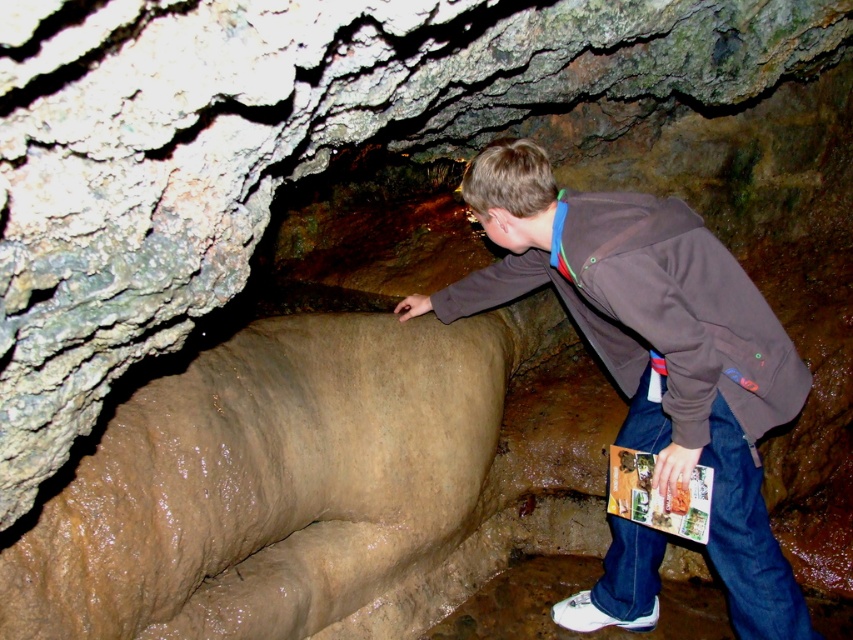
Question: Is brown cotton hoodie at center wider than brown cotton jacket at center?

Choices:
 (A) yes
 (B) no

Answer: (A)

Question: Which object is closer to the camera taking this photo?

Choices:
 (A) brown cotton jacket at center
 (B) brown cotton hoodie at center

Answer: (A)

Question: Does brown cotton hoodie at center lie in front of brown cotton jacket at center?

Choices:
 (A) no
 (B) yes

Answer: (A)

Question: Which object appears closest to the camera in this image?

Choices:
 (A) brown cotton jacket at center
 (B) brown cotton hoodie at center

Answer: (A)

Question: Can you confirm if brown cotton hoodie at center is positioned to the left of brown cotton jacket at center?

Choices:
 (A) yes
 (B) no

Answer: (B)